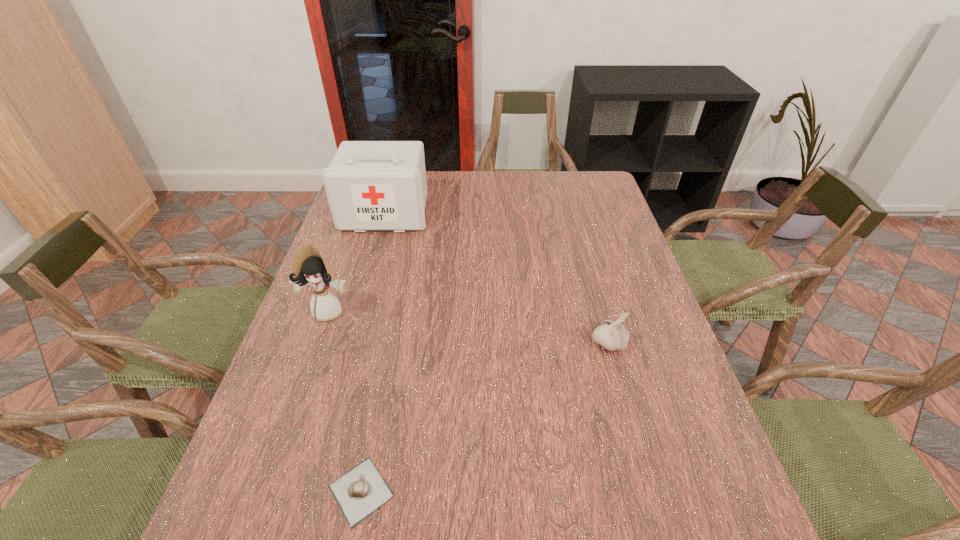
The height and width of the screenshot is (540, 960). I want to click on vacant space at the right edge of the desktop, so click(668, 434).

Identify the location of empty location between the right garlic and the tallest object. The image size is (960, 540). pos(496,278).

Image resolution: width=960 pixels, height=540 pixels. Find the location of `free space that is in between the shorter garlic and the tallest object`. free space that is in between the shorter garlic and the tallest object is located at coordinates (373, 352).

Identify the location of vacant area between the first-aid kit and the second nearest object. (496, 278).

The height and width of the screenshot is (540, 960). I want to click on free spot between the third tallest object and the nearest object, so click(x=485, y=417).

Locate an element on the screen. This screenshot has width=960, height=540. vacant space that's between the shorter garlic and the doll is located at coordinates (345, 401).

At what (x,y) coordinates should I click in order to perform the action: click on vacant space in between the left garlic and the farther garlic. Please return your answer as a coordinate pair (x, y). Looking at the image, I should click on (485, 417).

Find the location of a particular element. vacant region between the third farthest object and the tallest object is located at coordinates (496, 278).

You are a GUI agent. You are given a task and a screenshot of the screen. Output one action in this format:
    pyautogui.click(x=<x>, y=<y>)
    Task: Click on the free space between the left garlic and the second farthest object
    Image resolution: width=960 pixels, height=540 pixels.
    Given the screenshot: What is the action you would take?
    click(345, 401)

Find the location of a particular element. free space that is in between the doll and the tallest object is located at coordinates (357, 262).